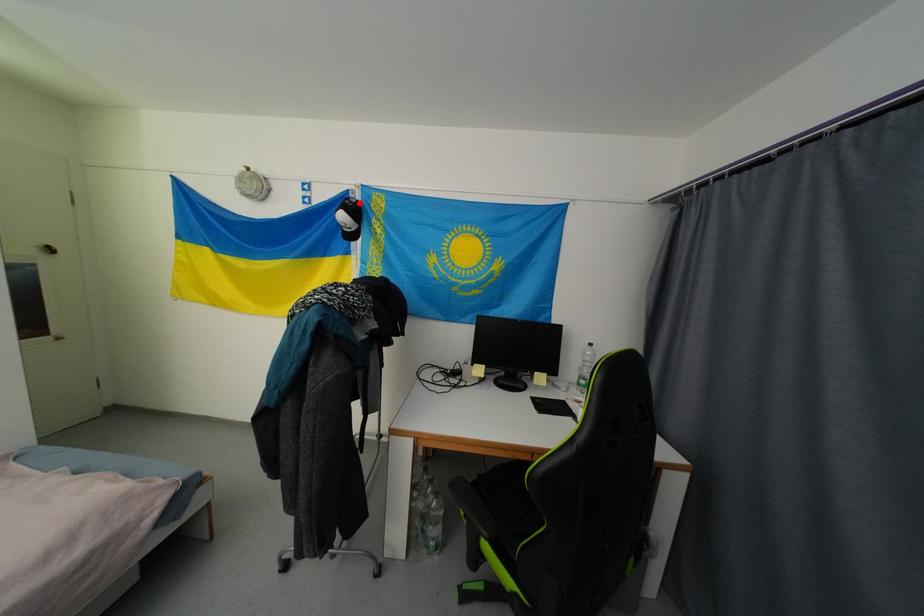
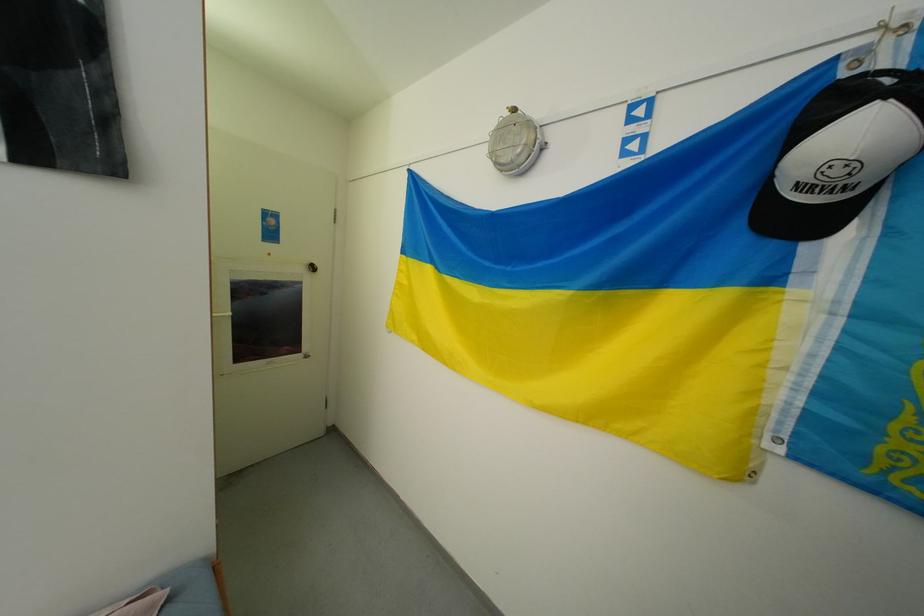
In the second image, find the point that corresponds to the highlighted location in the first image.

(896, 81)